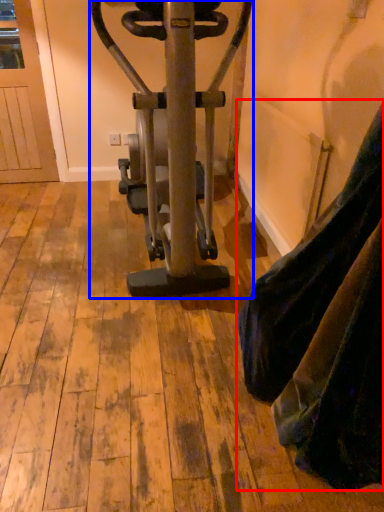
Question: Among these objects, which one is nearest to the camera, tight (highlighted by a red box) or stationary bicycle (highlighted by a blue box)?

Choices:
 (A) tight
 (B) stationary bicycle

Answer: (A)